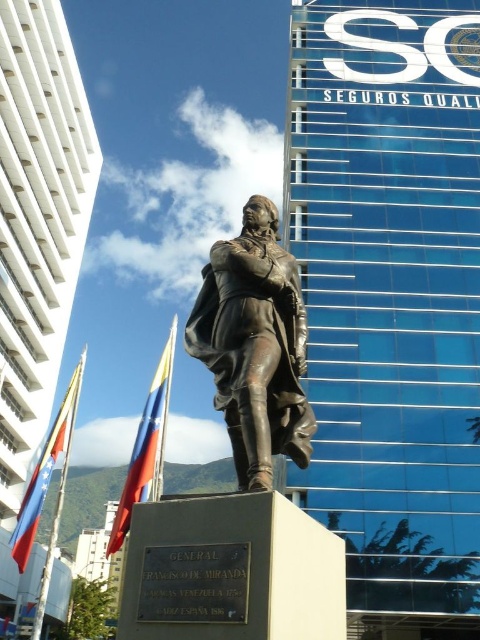
Question: Is bronze statue at center smaller than red fabric flag at lower left?

Choices:
 (A) yes
 (B) no

Answer: (A)

Question: Is red fabric flag at center bigger than red fabric flag at lower left?

Choices:
 (A) yes
 (B) no

Answer: (A)

Question: Which of the following is the closest to the observer?

Choices:
 (A) red fabric flag at lower left
 (B) red fabric flag at center

Answer: (B)

Question: Which object appears closest to the camera in this image?

Choices:
 (A) red fabric flag at center
 (B) bronze statue at center

Answer: (B)

Question: Does bronze statue at center come behind red fabric flag at center?

Choices:
 (A) yes
 (B) no

Answer: (B)

Question: Which object appears closest to the camera in this image?

Choices:
 (A) red fabric flag at lower left
 (B) red fabric flag at center

Answer: (B)